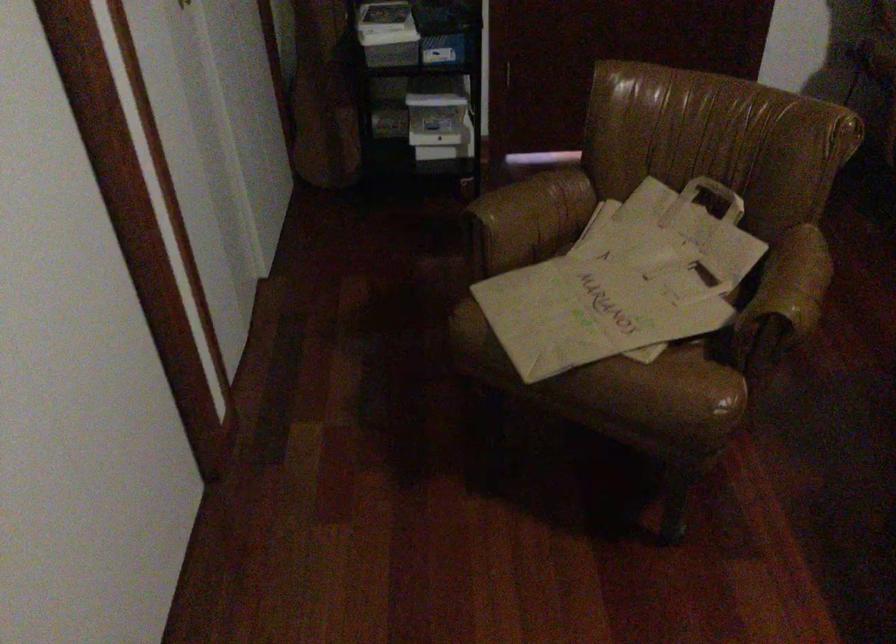
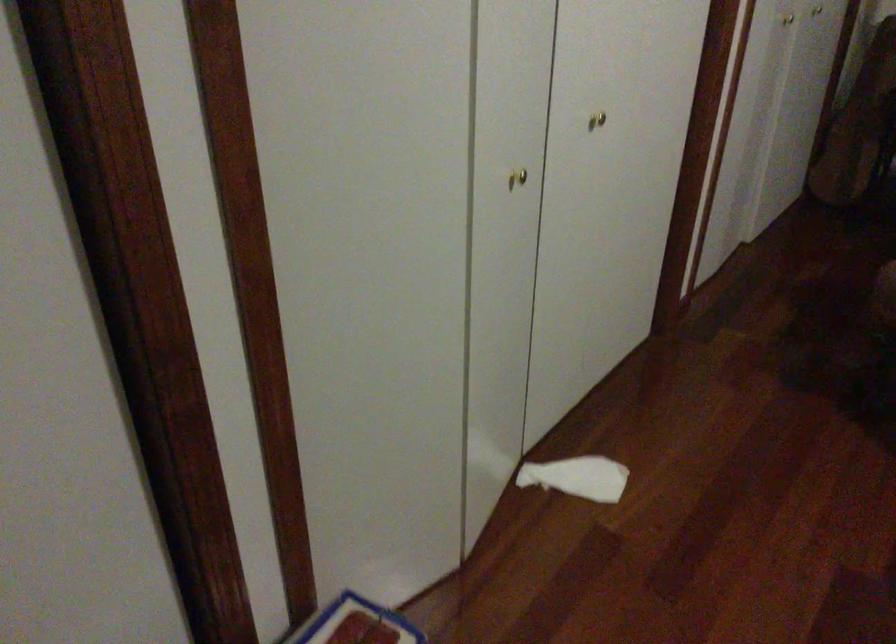
Question: The camera is either moving clockwise (left) or counter-clockwise (right) around the object. The first image is from the beginning of the video and the second image is from the end. Is the camera moving left or right when shooting the video?

Choices:
 (A) Left
 (B) Right

Answer: (B)